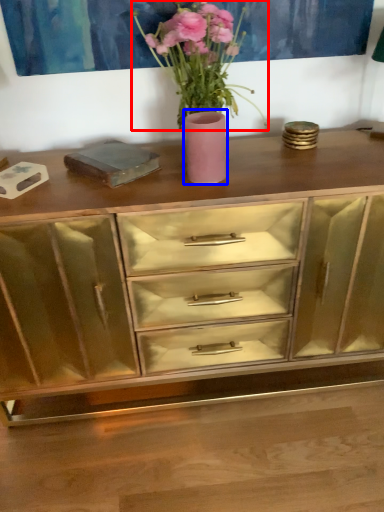
Question: Which object is closer to the camera taking this photo, floral arrangement (highlighted by a red box) or vase (highlighted by a blue box)?

Choices:
 (A) floral arrangement
 (B) vase

Answer: (A)